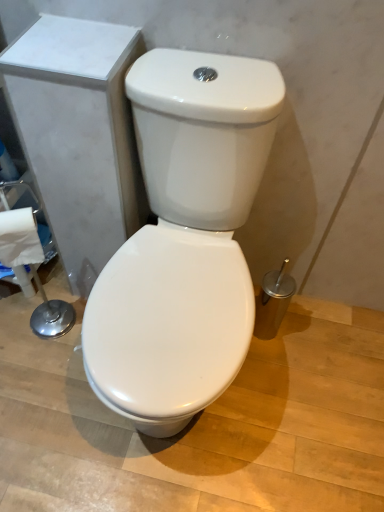
Question: Considering the relative sizes of white glossy toilet at center and white paper towel at lower left in the image provided, is white glossy toilet at center smaller than white paper towel at lower left?

Choices:
 (A) yes
 (B) no

Answer: (B)

Question: Is white glossy toilet at center facing towards white paper towel at lower left?

Choices:
 (A) no
 (B) yes

Answer: (A)

Question: Considering the relative sizes of white glossy toilet at center and white paper towel at lower left in the image provided, is white glossy toilet at center taller than white paper towel at lower left?

Choices:
 (A) yes
 (B) no

Answer: (A)

Question: Is white glossy toilet at center far from white paper towel at lower left?

Choices:
 (A) no
 (B) yes

Answer: (A)

Question: From the image's perspective, is white glossy toilet at center beneath white paper towel at lower left?

Choices:
 (A) no
 (B) yes

Answer: (B)

Question: Does white glossy toilet at center have a lesser width compared to white paper towel at lower left?

Choices:
 (A) yes
 (B) no

Answer: (B)

Question: Is white glossy toilet at center located within white paper towel at lower left?

Choices:
 (A) no
 (B) yes

Answer: (A)

Question: Is white paper towel at lower left thinner than white glossy toilet at center?

Choices:
 (A) no
 (B) yes

Answer: (B)

Question: Would you say white paper towel at lower left is outside white glossy toilet at center?

Choices:
 (A) yes
 (B) no

Answer: (A)

Question: Are white paper towel at lower left and white glossy toilet at center making contact?

Choices:
 (A) yes
 (B) no

Answer: (B)

Question: From the image's perspective, is white paper towel at lower left beneath white glossy toilet at center?

Choices:
 (A) no
 (B) yes

Answer: (A)

Question: Can you confirm if white paper towel at lower left is bigger than white glossy toilet at center?

Choices:
 (A) no
 (B) yes

Answer: (A)

Question: From the image's perspective, relative to white paper towel at lower left, is white glossy toilet at center above or below?

Choices:
 (A) above
 (B) below

Answer: (B)